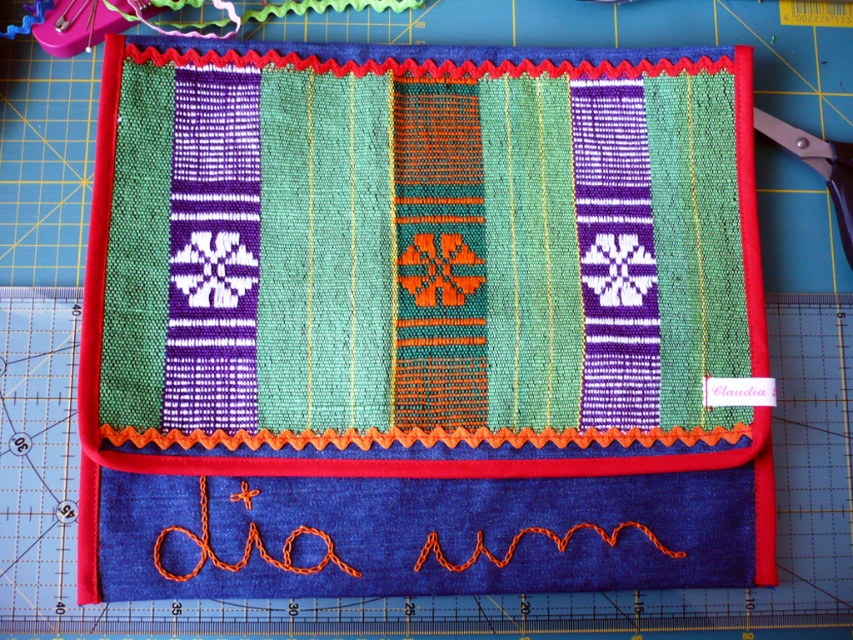
Question: Considering the relative positions of textured fabric mat at center and black plastic scissors at upper right in the image provided, where is textured fabric mat at center located with respect to black plastic scissors at upper right?

Choices:
 (A) above
 (B) below

Answer: (B)

Question: Among these points, which one is nearest to the camera?

Choices:
 (A) (709, 166)
 (B) (793, 147)

Answer: (A)

Question: Does textured fabric mat at center appear under black plastic scissors at upper right?

Choices:
 (A) no
 (B) yes

Answer: (B)

Question: Where is textured fabric mat at center located in relation to black plastic scissors at upper right in the image?

Choices:
 (A) left
 (B) right

Answer: (A)

Question: Among these objects, which one is farthest from the camera?

Choices:
 (A) black plastic scissors at upper right
 (B) textured fabric mat at center

Answer: (A)